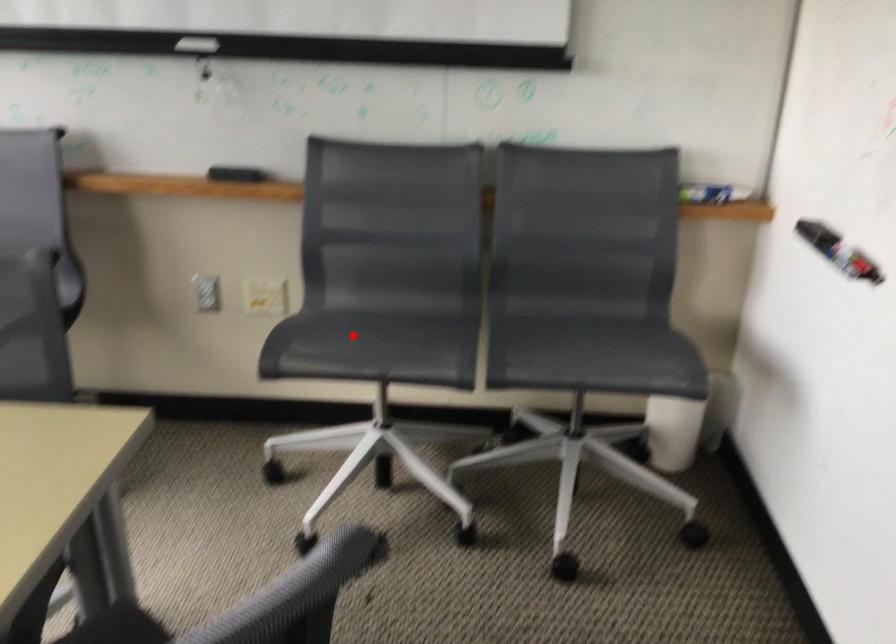
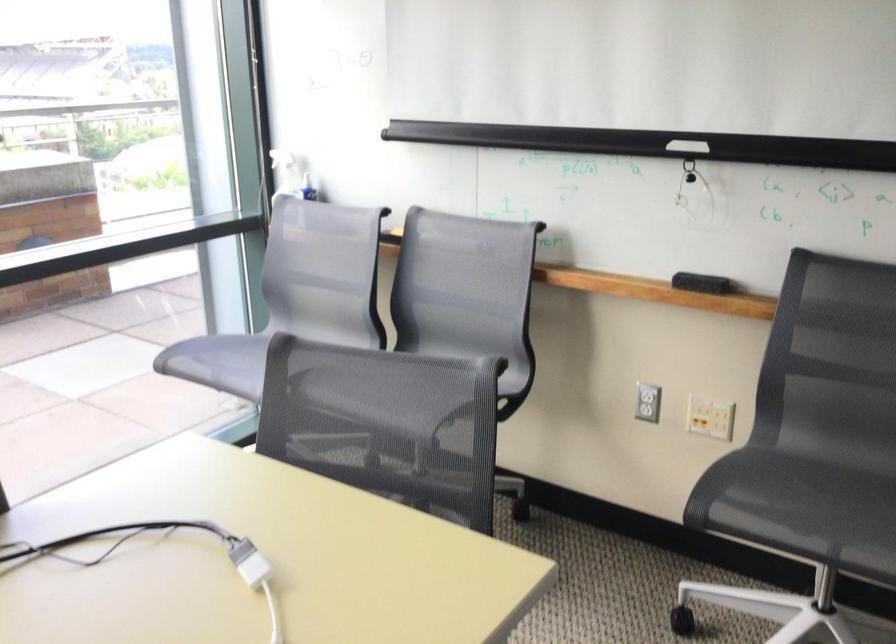
Question: A red point is marked in image1. In image2, is the corresponding 3D point closer to the camera or farther? Reply with the corresponding letter.

Choices:
 (A) The corresponding 3D point is closer.
 (B) The corresponding 3D point is farther.

Answer: (A)